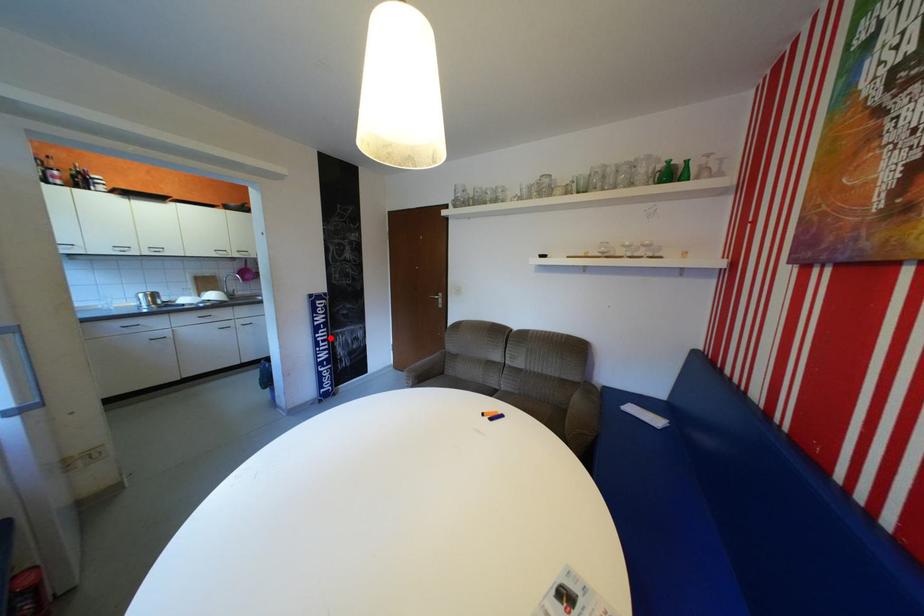
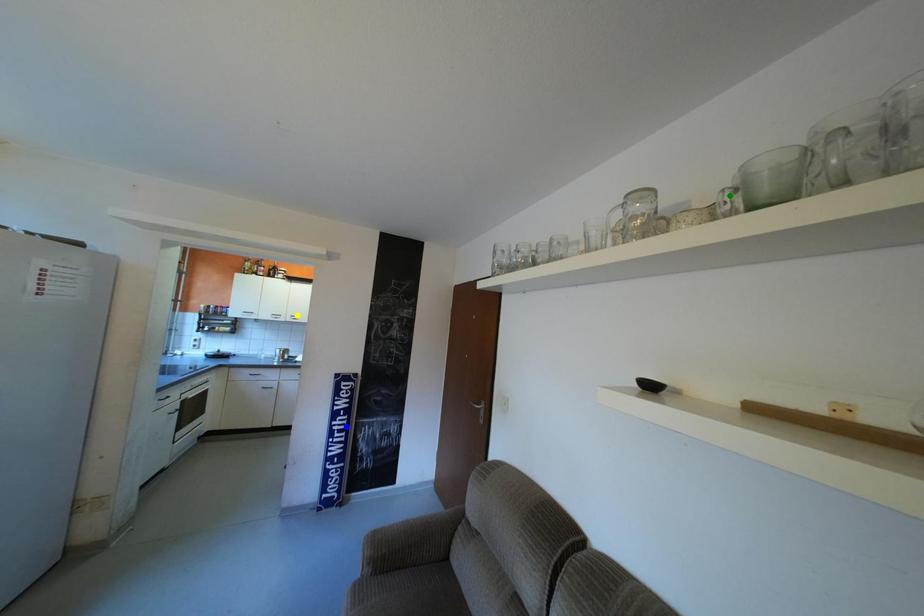
Question: I am providing you with two images of the same scene from different viewpoints. A red point is marked on the first image. You are given multiple points on the second image. Which point in image 2 represents the same 3d spot as the red point in image 1?

Choices:
 (A) green point
 (B) blue point
 (C) yellow point

Answer: (B)